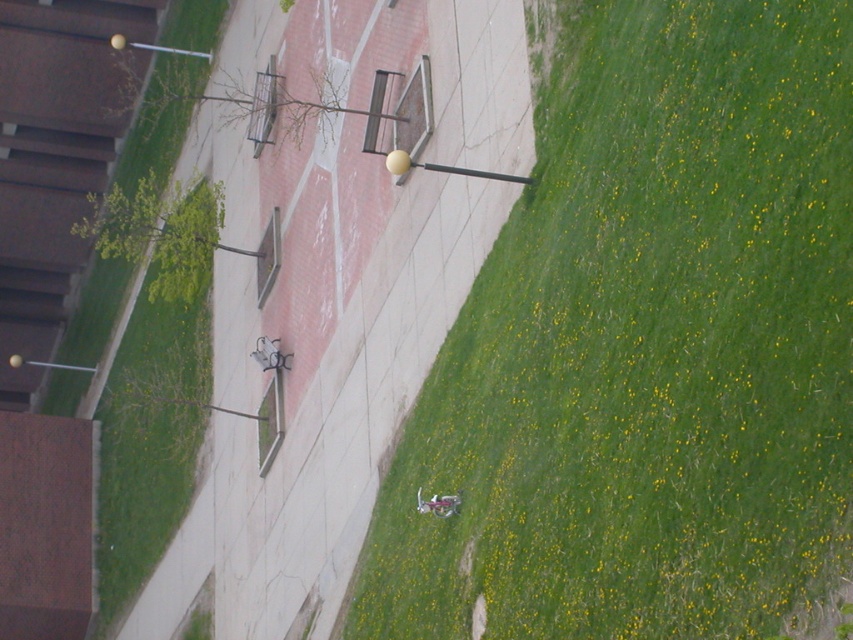
Question: Which point is closer to the camera?

Choices:
 (A) green grassy at lower right
 (B) pink matte motorcycle at lower center

Answer: (A)

Question: Can you confirm if green grassy at lower right is positioned above green grassy at left?

Choices:
 (A) no
 (B) yes

Answer: (A)

Question: Does green grassy at left have a lesser width compared to pink matte motorcycle at lower center?

Choices:
 (A) no
 (B) yes

Answer: (A)

Question: Which of the following is the closest to the observer?

Choices:
 (A) green grassy at left
 (B) green grassy at lower right

Answer: (B)

Question: Is green grassy at lower right above pink matte motorcycle at lower center?

Choices:
 (A) no
 (B) yes

Answer: (B)

Question: Which object is the farthest from the green grassy at left?

Choices:
 (A) pink matte motorcycle at lower center
 (B) green grassy at lower right

Answer: (A)